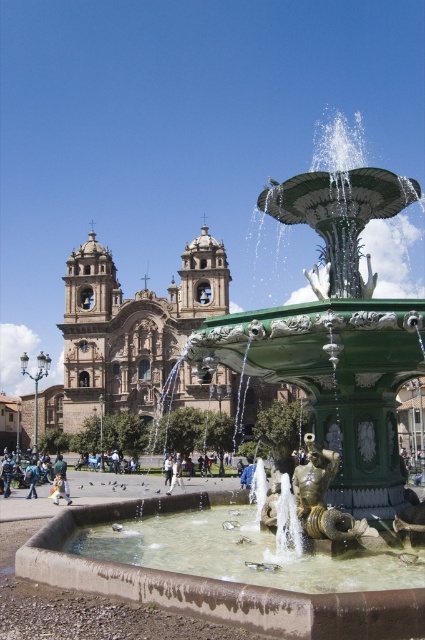
Question: Is denim jacket at lower left positioned before white fabric pants at center?

Choices:
 (A) yes
 (B) no

Answer: (B)

Question: Is denim jacket at lower left above white fabric pants at center?

Choices:
 (A) no
 (B) yes

Answer: (A)

Question: Can you confirm if denim jacket at lower left is smaller than white fabric pants at center?

Choices:
 (A) no
 (B) yes

Answer: (A)